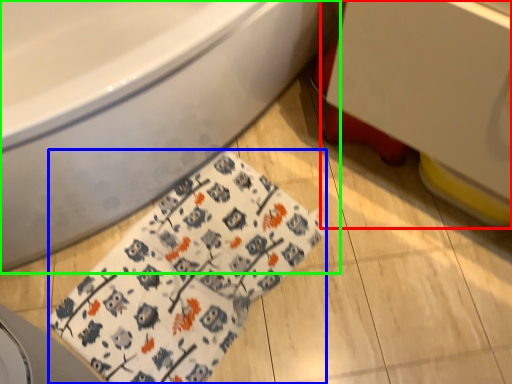
Question: Considering the real-world distances, which object is closest to sink (highlighted by a red box)? blanket (highlighted by a blue box) or bathtub (highlighted by a green box).

Choices:
 (A) blanket
 (B) bathtub

Answer: (B)